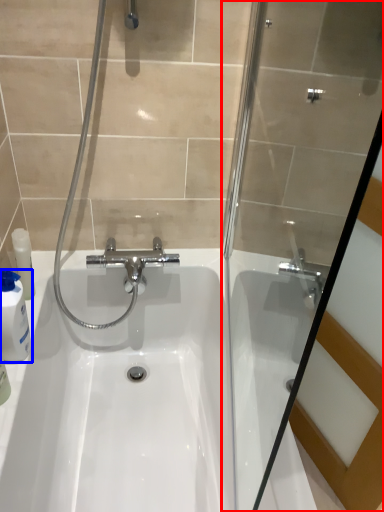
Question: Which object appears farthest to the camera in this image, shower door (highlighted by a red box) or cleaning product (highlighted by a blue box)?

Choices:
 (A) shower door
 (B) cleaning product

Answer: (B)